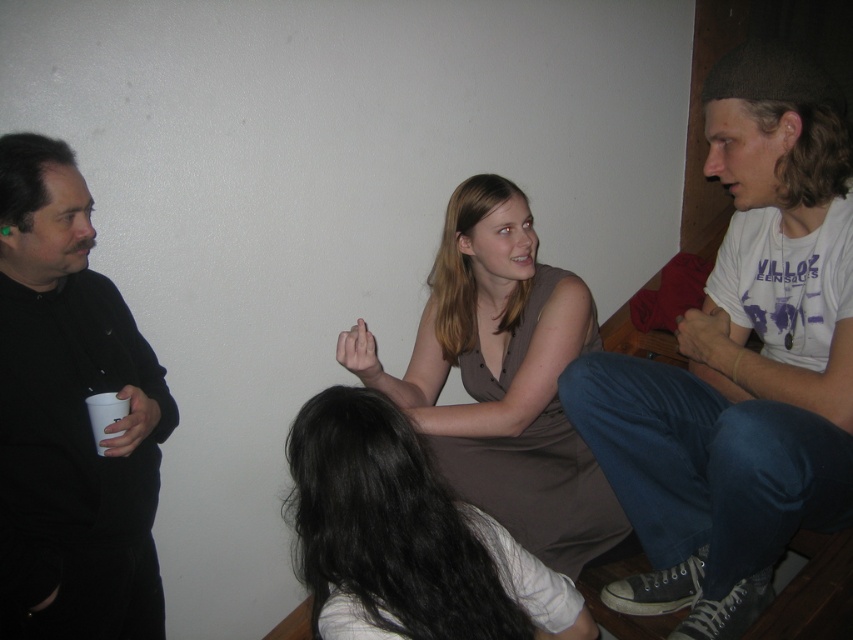
You are standing in the room and want to hand a gift to the person wearing the smooth brown dress at center without disturbing the person in the black matte shirt at left. How can you approach them?

The smooth brown dress at center is behind the black matte shirt at left, so you can approach from behind the black matte shirt at left to reach the smooth brown dress at center without disturbing them.